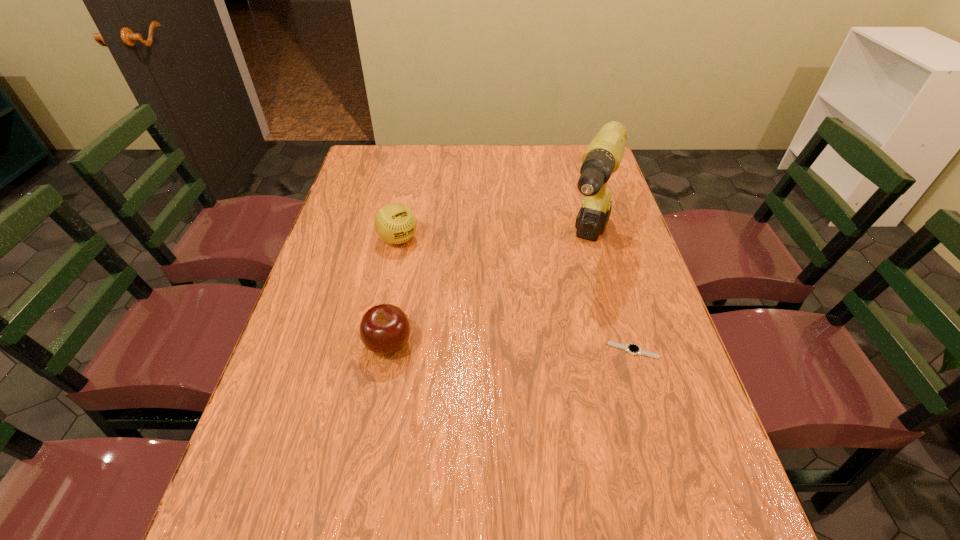
Locate an element on the screen. This screenshot has height=540, width=960. apple is located at coordinates (384, 329).

This screenshot has height=540, width=960. In order to click on the shortest object in this screenshot , I will do `click(633, 349)`.

This screenshot has height=540, width=960. In order to click on drill in this screenshot , I will do `click(603, 156)`.

The width and height of the screenshot is (960, 540). Identify the location of softball. (395, 223).

I want to click on vacant space situated 0.350m on the right of the apple, so click(x=563, y=345).

Locate an element on the screen. blank space located 0.380m on the left of the shortest object is located at coordinates (444, 350).

Where is `free region located 0.340m on the handle side of the drill`? free region located 0.340m on the handle side of the drill is located at coordinates point(543,381).

This screenshot has height=540, width=960. I want to click on vacant space positioned 0.080m on the handle side of the drill, so click(575, 300).

You are a GUI agent. You are given a task and a screenshot of the screen. Output one action in this format:
    pyautogui.click(x=<x>, y=<y>)
    Task: Click on the blank space located 0.380m on the handle side of the drill
    This screenshot has height=540, width=960.
    Given the screenshot: What is the action you would take?
    pyautogui.click(x=538, y=396)

Locate an element on the screen. This screenshot has width=960, height=540. free space located on the logo side of the softball is located at coordinates (460, 305).